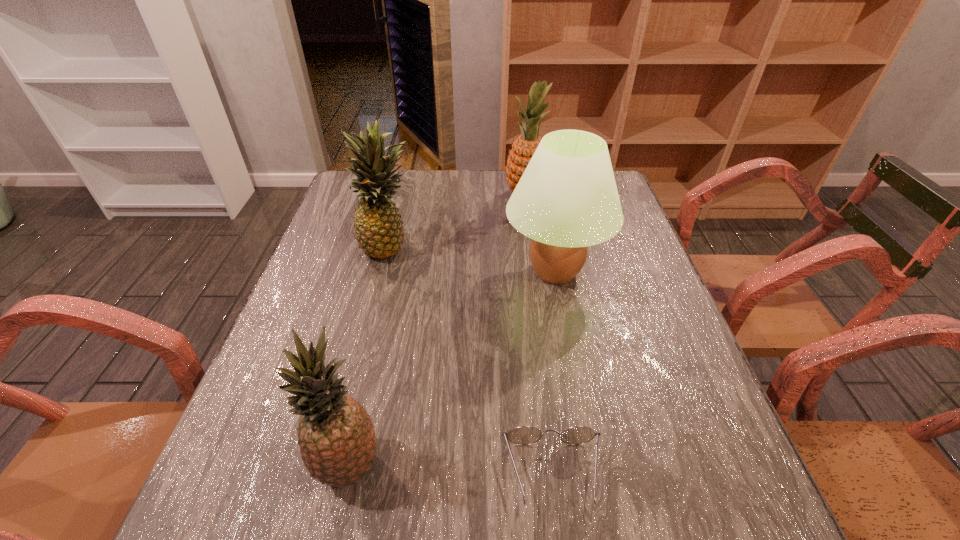
Where is `the rightmost pineapple`? This screenshot has height=540, width=960. the rightmost pineapple is located at coordinates (523, 148).

Image resolution: width=960 pixels, height=540 pixels. I want to click on the farthest pineapple, so click(523, 148).

This screenshot has width=960, height=540. What are the coordinates of `lampshade` in the screenshot? It's located at (567, 199).

Where is `the second nearest pineapple`? This screenshot has height=540, width=960. the second nearest pineapple is located at coordinates (379, 231).

This screenshot has height=540, width=960. What are the coordinates of `the nearest pineapple` in the screenshot? It's located at (337, 440).

Identify the location of spectacles. This screenshot has width=960, height=540. (524, 435).

The width and height of the screenshot is (960, 540). Find the location of `free space located on the left of the farthest pineapple`. free space located on the left of the farthest pineapple is located at coordinates (393, 197).

Identify the location of free space located on the shade of the lampshade. The width and height of the screenshot is (960, 540). (354, 272).

Where is `vacant space located on the shade of the lampshade`? Image resolution: width=960 pixels, height=540 pixels. vacant space located on the shade of the lampshade is located at coordinates click(x=464, y=272).

The width and height of the screenshot is (960, 540). What are the coordinates of `vacant region located 0.130m on the shade of the lampshade` in the screenshot? It's located at click(x=452, y=272).